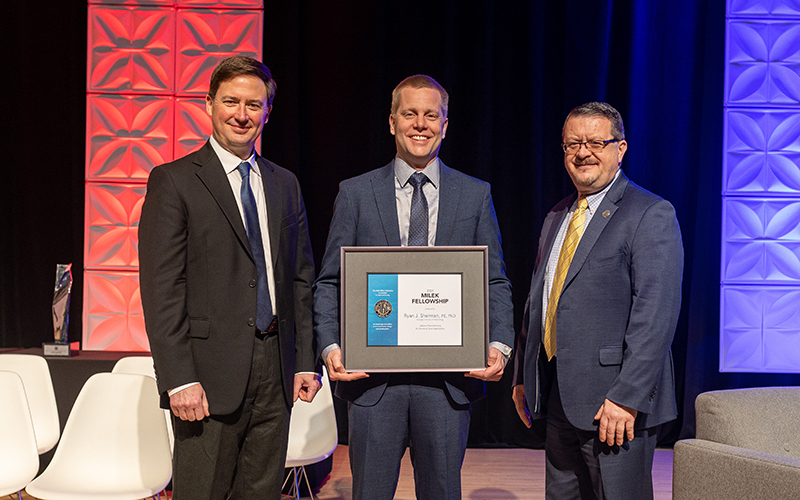
Where is `black curtain`? black curtain is located at coordinates (50, 42), (33, 177), (349, 130), (481, 140), (344, 40).